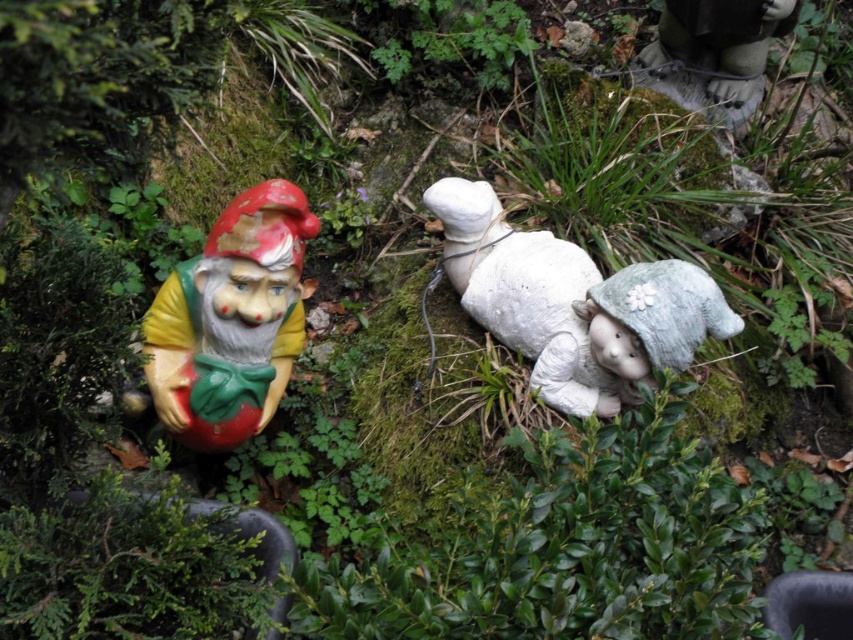
You are a landscape designer planning to add a new gnome to this garden. The new gnome will be placed at point 0.5, 0.27. Will it be placed to the left or right of the existing matte plastic gnome at left?

The new gnome will be placed to the right of the existing matte plastic gnome at left because the new position is at 0.5, which is slightly to the right of the existing gnome at 0.495 on the x axis.